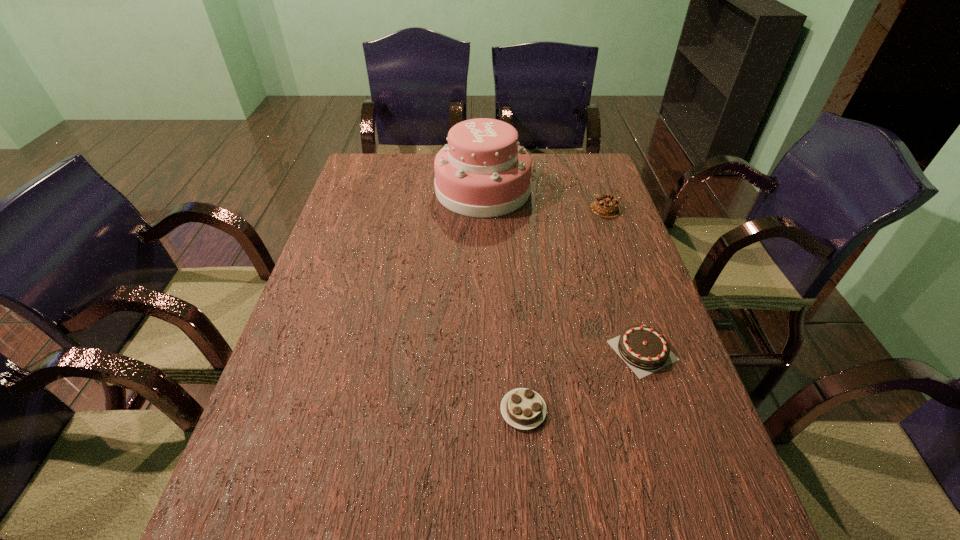
What are the coordinates of `vacant area situated 0.150m on the front of the shortest object` in the screenshot? It's located at (531, 514).

Find the location of a particular element. Image resolution: width=960 pixels, height=540 pixels. object at the far edge is located at coordinates [x=483, y=172].

In the image, there is a desktop. Identify the location of vacant space at the far edge. (539, 176).

Image resolution: width=960 pixels, height=540 pixels. In the image, there is a desktop. What are the coordinates of `free space at the left edge` in the screenshot? It's located at (331, 287).

Image resolution: width=960 pixels, height=540 pixels. What are the coordinates of `free space at the right edge of the desktop` in the screenshot? It's located at (596, 240).

Locate an element on the screen. The height and width of the screenshot is (540, 960). vacant region at the far left corner of the desktop is located at coordinates (383, 174).

Identify the location of vacant area at the far right corner of the desktop. Image resolution: width=960 pixels, height=540 pixels. pos(576,154).

Locate an element on the screen. The image size is (960, 540). free space between the second farthest chocolate cake and the birthday cake is located at coordinates (563, 270).

This screenshot has height=540, width=960. Find the location of `vacant region between the third farthest object and the leftmost chocolate cake`. vacant region between the third farthest object and the leftmost chocolate cake is located at coordinates (583, 380).

What are the coordinates of `free point between the third farthest object and the leftmost chocolate cake` in the screenshot? It's located at (583, 380).